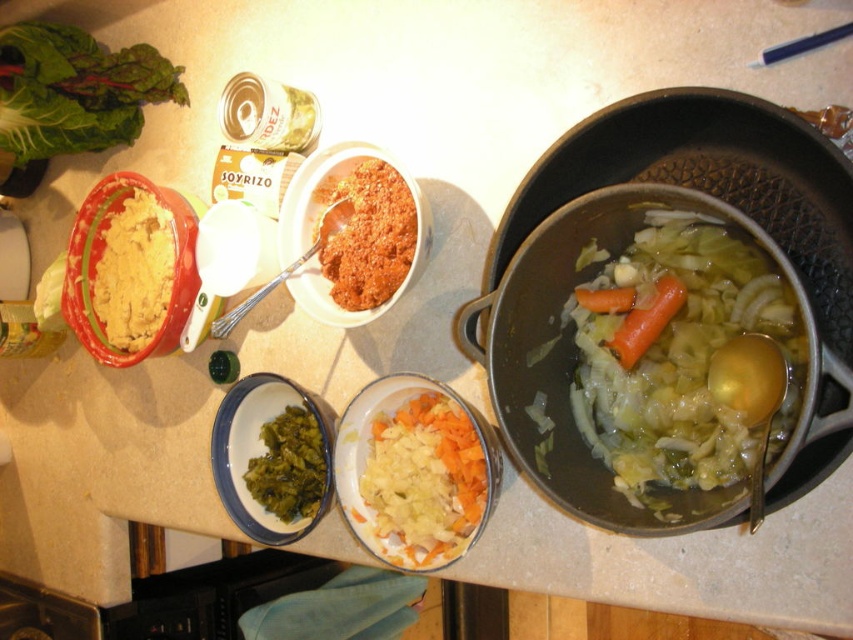
Question: Estimate the real-world distances between objects in this image. Which object is farther from the green leafy material/texture at position?

Choices:
 (A) matte black pot at center
 (B) green leafy vegetable at upper left
 (C) brown crumbly mix at center
 (D) white diced vegetables at center

Answer: (B)

Question: Which of these objects is positioned closest to the white diced vegetables at center?

Choices:
 (A) orange smooth carrot at center
 (B) green leafy material/texture at position
 (C) green leafy vegetable at upper left
 (D) brown crumbly mix at center

Answer: (B)

Question: Which point is farther to the camera?

Choices:
 (A) green leafy vegetable at upper left
 (B) yellow mashed potato at left
 (C) white diced vegetables at center

Answer: (A)

Question: Can you confirm if brown crumbly mix at center is positioned above green leafy material/texture at position?

Choices:
 (A) no
 (B) yes

Answer: (B)

Question: Where is white diced vegetables at center located in relation to yellow mashed potato at left in the image?

Choices:
 (A) right
 (B) left

Answer: (A)

Question: Can you confirm if matte black pot at center is positioned below orange smooth carrot at center?

Choices:
 (A) yes
 (B) no

Answer: (B)